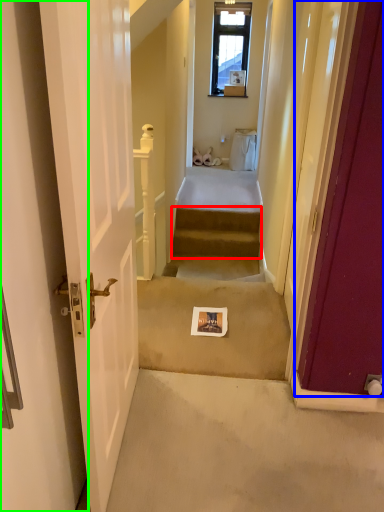
Question: Based on their relative distances, which object is nearer to stairs (highlighted by a red box)? Choose from door (highlighted by a blue box) and door (highlighted by a green box).

Choices:
 (A) door
 (B) door

Answer: (A)